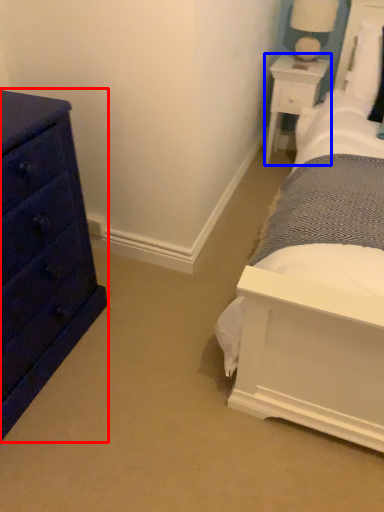
Question: Which point is further to the camera, chest of drawers (highlighted by a red box) or nightstand (highlighted by a blue box)?

Choices:
 (A) chest of drawers
 (B) nightstand

Answer: (B)